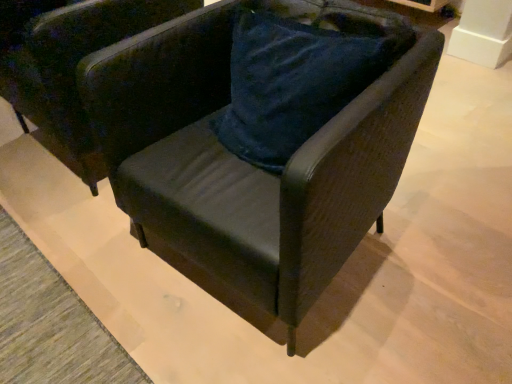
You are a GUI agent. You are given a task and a screenshot of the screen. Output one action in this format:
    pyautogui.click(x=<x>, y=<y>)
    Task: Click on the velvet dark green armchair at center, the 2th chair viewed from the left
    The image size is (512, 384).
    Given the screenshot: What is the action you would take?
    pyautogui.click(x=248, y=172)

What do you see at coordinates (248, 172) in the screenshot? The height and width of the screenshot is (384, 512). I see `velvet dark green armchair at center, the 1th chair in the right-to-left sequence` at bounding box center [248, 172].

The image size is (512, 384). I want to click on velvet dark green armchair at center, acting as the first chair starting from the left, so click(x=73, y=67).

What do you see at coordinates (73, 67) in the screenshot? I see `velvet dark green armchair at center, acting as the first chair starting from the left` at bounding box center [73, 67].

From the picture: How much space does velvet dark green armchair at center, acting as the first chair starting from the left, occupy horizontally?

velvet dark green armchair at center, acting as the first chair starting from the left, is 31.45 inches in width.

Where is `velvet dark green armchair at center, the 2th chair viewed from the left`? The height and width of the screenshot is (384, 512). velvet dark green armchair at center, the 2th chair viewed from the left is located at coordinates (248, 172).

In the image, is velvet dark green armchair at center, the 2th chair positioned from the right, on the left side or the right side of velvet dark green armchair at center, the 1th chair in the right-to-left sequence?

Based on their positions, velvet dark green armchair at center, the 2th chair positioned from the right, is located to the left of velvet dark green armchair at center, the 1th chair in the right-to-left sequence.

Which object is closer to the camera, velvet dark green armchair at center, acting as the first chair starting from the left, or velvet dark green armchair at center, the 2th chair viewed from the left?

Positioned in front is velvet dark green armchair at center, the 2th chair viewed from the left.

Considering the points (46, 31) and (396, 85), which point is in front, point (46, 31) or point (396, 85)?

Positioned in front is point (396, 85).

From the image's perspective, who appears lower, velvet dark green armchair at center, the 2th chair positioned from the right, or velvet dark green armchair at center, the 1th chair in the right-to-left sequence?

velvet dark green armchair at center, the 1th chair in the right-to-left sequence, appears lower in the image.

From a real-world perspective, is velvet dark green armchair at center, acting as the first chair starting from the left, positioned under velvet dark green armchair at center, the 1th chair in the right-to-left sequence, based on gravity?

No, from a real-world perspective, velvet dark green armchair at center, acting as the first chair starting from the left, is not beneath velvet dark green armchair at center, the 1th chair in the right-to-left sequence.

Is velvet dark green armchair at center, acting as the first chair starting from the left, wider or thinner than velvet dark green armchair at center, the 1th chair in the right-to-left sequence?

velvet dark green armchair at center, acting as the first chair starting from the left, is wider than velvet dark green armchair at center, the 1th chair in the right-to-left sequence.

Can you confirm if velvet dark green armchair at center, acting as the first chair starting from the left, is shorter than velvet dark green armchair at center, the 2th chair viewed from the left?

Yes.

Who is bigger, velvet dark green armchair at center, the 2th chair positioned from the right, or velvet dark green armchair at center, the 1th chair in the right-to-left sequence?

Bigger between the two is velvet dark green armchair at center, the 2th chair positioned from the right.

In the scene shown: Would you say velvet dark green armchair at center, acting as the first chair starting from the left, is outside velvet dark green armchair at center, the 2th chair viewed from the left?

velvet dark green armchair at center, acting as the first chair starting from the left, is positioned outside velvet dark green armchair at center, the 2th chair viewed from the left.

Consider the image. Can you see velvet dark green armchair at center, acting as the first chair starting from the left, touching velvet dark green armchair at center, the 2th chair viewed from the left?

They are not placed beside each other.

Could you tell me if velvet dark green armchair at center, the 2th chair positioned from the right, is turned towards velvet dark green armchair at center, the 1th chair in the right-to-left sequence?

No, velvet dark green armchair at center, the 2th chair positioned from the right, is not turned towards velvet dark green armchair at center, the 1th chair in the right-to-left sequence.

This screenshot has width=512, height=384. In order to click on chair below the velvet dark green armchair at center, acting as the first chair starting from the left (from a real-world perspective) in this screenshot , I will do `click(248, 172)`.

Would you say velvet dark green armchair at center, the 2th chair viewed from the left, is to the left or to the right of velvet dark green armchair at center, the 2th chair positioned from the right, in the picture?

From the image, it's evident that velvet dark green armchair at center, the 2th chair viewed from the left, is to the right of velvet dark green armchair at center, the 2th chair positioned from the right.

Is velvet dark green armchair at center, the 2th chair viewed from the left, positioned in front of velvet dark green armchair at center, acting as the first chair starting from the left?

Yes, it is.

Considering the positions of point (172, 95) and point (40, 119), is point (172, 95) closer or farther from the camera than point (40, 119)?

Point (172, 95).

From the image's perspective, relative to velvet dark green armchair at center, acting as the first chair starting from the left, is velvet dark green armchair at center, the 1th chair in the right-to-left sequence, above or below?

Clearly, from the image's perspective, velvet dark green armchair at center, the 1th chair in the right-to-left sequence, is below velvet dark green armchair at center, acting as the first chair starting from the left.

From a real-world perspective, which is physically below, velvet dark green armchair at center, the 2th chair viewed from the left, or velvet dark green armchair at center, the 2th chair positioned from the right?

velvet dark green armchair at center, the 2th chair viewed from the left, is physically lower.

Based on the photo, which object is thinner, velvet dark green armchair at center, the 1th chair in the right-to-left sequence, or velvet dark green armchair at center, the 2th chair positioned from the right?

With smaller width is velvet dark green armchair at center, the 1th chair in the right-to-left sequence.

In terms of height, does velvet dark green armchair at center, the 1th chair in the right-to-left sequence, look taller or shorter compared to velvet dark green armchair at center, acting as the first chair starting from the left?

In the image, velvet dark green armchair at center, the 1th chair in the right-to-left sequence, appears to be taller than velvet dark green armchair at center, acting as the first chair starting from the left.

Is velvet dark green armchair at center, the 2th chair viewed from the left, smaller than velvet dark green armchair at center, acting as the first chair starting from the left?

Yes, velvet dark green armchair at center, the 2th chair viewed from the left, is smaller than velvet dark green armchair at center, acting as the first chair starting from the left.

Can we say velvet dark green armchair at center, the 2th chair viewed from the left, lies outside velvet dark green armchair at center, the 2th chair positioned from the right?

Indeed, velvet dark green armchair at center, the 2th chair viewed from the left, is completely outside velvet dark green armchair at center, the 2th chair positioned from the right.

Is velvet dark green armchair at center, the 1th chair in the right-to-left sequence, far from velvet dark green armchair at center, the 2th chair positioned from the right?

No, there isn't a large distance between velvet dark green armchair at center, the 1th chair in the right-to-left sequence, and velvet dark green armchair at center, the 2th chair positioned from the right.

Could you tell me if velvet dark green armchair at center, the 1th chair in the right-to-left sequence, is facing velvet dark green armchair at center, the 2th chair positioned from the right?

No, velvet dark green armchair at center, the 1th chair in the right-to-left sequence, is not turned towards velvet dark green armchair at center, the 2th chair positioned from the right.

How different are the orientations of velvet dark green armchair at center, the 1th chair in the right-to-left sequence, and velvet dark green armchair at center, acting as the first chair starting from the left, in degrees?

The facing directions of velvet dark green armchair at center, the 1th chair in the right-to-left sequence, and velvet dark green armchair at center, acting as the first chair starting from the left, are 0.000403 degrees apart.

How far apart are velvet dark green armchair at center, the 2th chair viewed from the left, and velvet dark green armchair at center, the 2th chair positioned from the right?

The distance of velvet dark green armchair at center, the 2th chair viewed from the left, from velvet dark green armchair at center, the 2th chair positioned from the right, is 22.90 inches.

At what (x,y) coordinates should I click in order to perform the action: click on chair on the left of velvet dark green armchair at center, the 2th chair viewed from the left. Please return your answer as a coordinate pair (x, y). This screenshot has width=512, height=384. Looking at the image, I should click on (73, 67).

Where is `chair above the velvet dark green armchair at center, the 2th chair viewed from the left (from the image's perspective)`? The height and width of the screenshot is (384, 512). chair above the velvet dark green armchair at center, the 2th chair viewed from the left (from the image's perspective) is located at coordinates (73, 67).

In order to click on chair above the velvet dark green armchair at center, the 1th chair in the right-to-left sequence (from a real-world perspective) in this screenshot , I will do `click(73, 67)`.